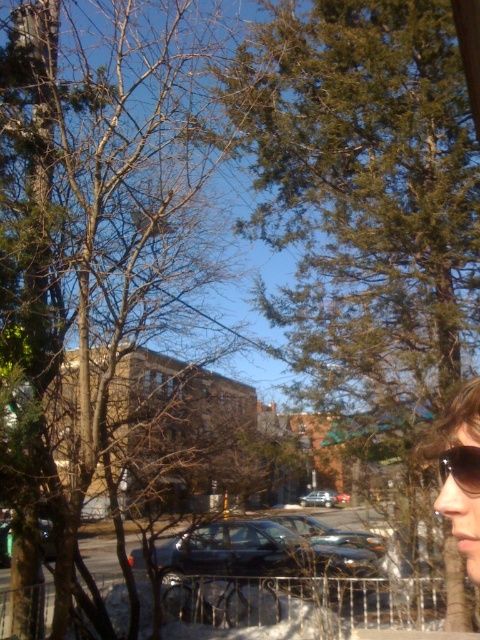
Can you confirm if bare branches at center is smaller than metallic silver sedan at center?

No.

Is bare branches at center bigger than metallic silver sedan at center?

Yes, bare branches at center is bigger than metallic silver sedan at center.

Describe the element at coordinates (90, 230) in the screenshot. I see `bare branches at center` at that location.

Locate an element on the screen. bare branches at center is located at coordinates (90, 230).

Where is `metallic gray sedan at center`? The width and height of the screenshot is (480, 640). metallic gray sedan at center is located at coordinates (262, 554).

What do you see at coordinates (262, 554) in the screenshot? I see `metallic gray sedan at center` at bounding box center [262, 554].

Which is behind, point (297, 584) or point (462, 412)?

The point (297, 584) is more distant.

Locate an element on the screen. This screenshot has height=640, width=480. metallic gray sedan at center is located at coordinates (262, 554).

Who is more forward, (213, 524) or (312, 502)?

Point (213, 524) is more forward.

What do you see at coordinates (262, 554) in the screenshot? Image resolution: width=480 pixels, height=640 pixels. I see `metallic gray sedan at center` at bounding box center [262, 554].

This screenshot has height=640, width=480. What are the coordinates of `metallic gray sedan at center` in the screenshot? It's located at (262, 554).